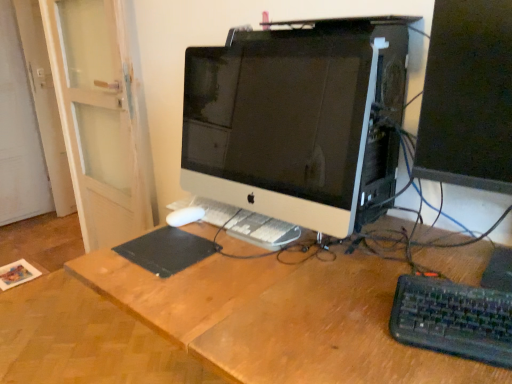
This screenshot has width=512, height=384. What are the coordinates of `free spot in front of white plastic keyboard at center` in the screenshot? It's located at (237, 286).